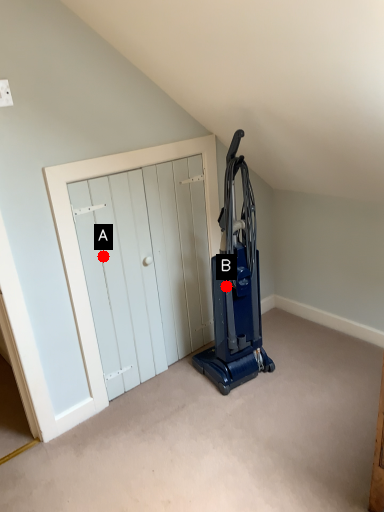
Question: Two points are circled on the image, labeled by A and B beside each circle. Which point is farther from the camera taking this photo?

Choices:
 (A) A is further
 (B) B is further

Answer: (B)